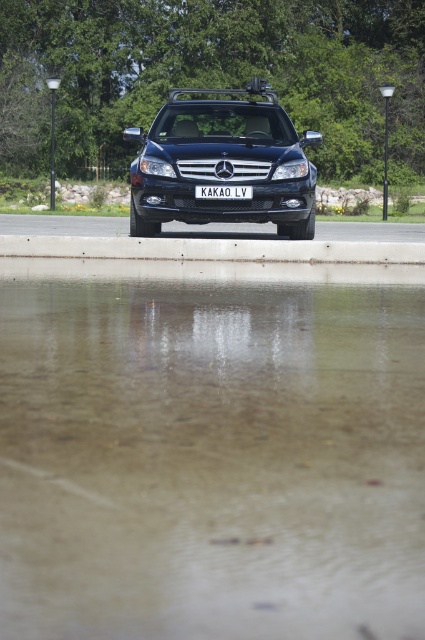
Question: Can you confirm if transparent water at lower center is positioned to the right of glossy black suv at center?

Choices:
 (A) no
 (B) yes

Answer: (B)

Question: Which point appears farthest from the camera in this image?

Choices:
 (A) (170, 257)
 (B) (295, 221)
 (C) (51, 595)
 (D) (227, 192)

Answer: (B)

Question: Which point is closer to the camera taking this photo?

Choices:
 (A) (220, 461)
 (B) (362, 280)
 (C) (234, 168)
 (D) (212, 195)

Answer: (A)

Question: Is transparent water at lower center positioned behind concrete at center?

Choices:
 (A) yes
 (B) no

Answer: (B)

Question: Can you confirm if glossy black suv at center is positioned below white plastic license plate at center?

Choices:
 (A) yes
 (B) no

Answer: (B)

Question: Among these objects, which one is nearest to the camera?

Choices:
 (A) glossy black suv at center
 (B) white plastic license plate at center

Answer: (B)